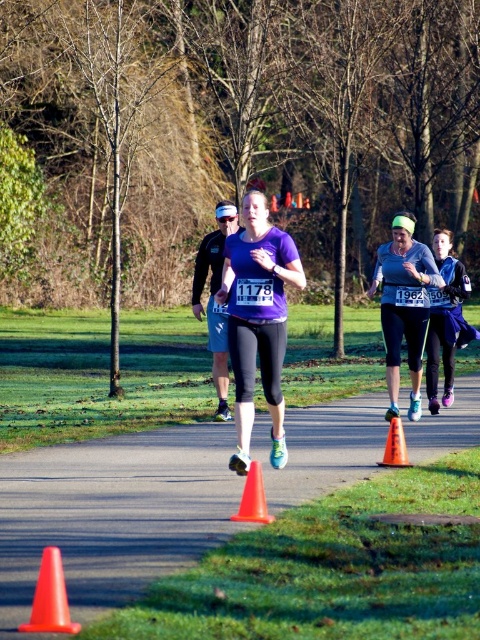
You are a runner participating in the race. You need to decide whether to stay on the smooth asphalt road at center or move to the matte black visor at center to avoid obstacles. Which path is wider?

The smooth asphalt road at center is wider than the matte black visor at center, so you should choose the smooth asphalt road at center to avoid obstacles.

From the picture: You are a drone operator assigned to capture aerial footage of the race. The drone is currently hovering at point 0.7, 0.2. To get a clear shot of the smooth asphalt road at center, should you move the drone north or south?

The smooth asphalt road at center is located at point (112, 515). Since the drone is at (96, 448), it needs to move north to reach the road.

You are a photographer positioned at the starting line of the race. You want to capture a photo that includes both the purple matte running top at center and the orange plastic cone at lower center. Based on their sizes in the image, which object should you focus on first to ensure both are clearly visible in the frame?

The purple matte running top at center is larger in size than the orange plastic cone at lower center. To ensure both are clearly visible, focus on the larger object first, which is the purple matte running top at center, as it will require more space in the frame.